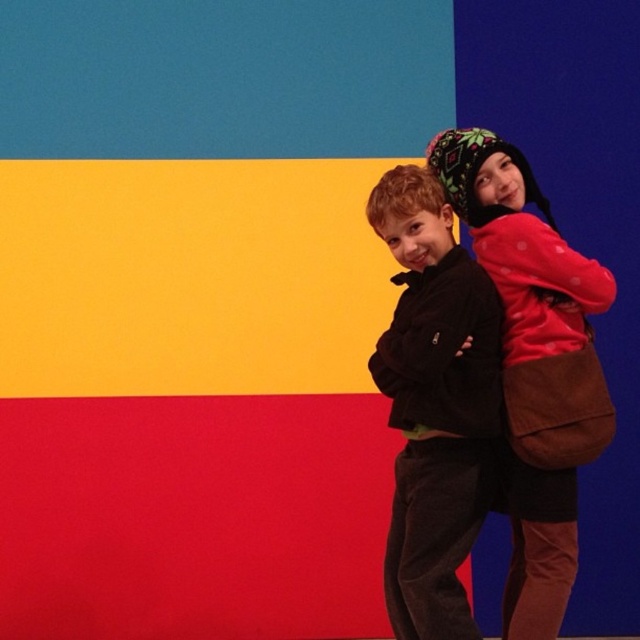
Question: Can you confirm if black fleece jacket at center is positioned above matte red sweater at right?

Choices:
 (A) no
 (B) yes

Answer: (A)

Question: Is black fleece jacket at center below matte red sweater at right?

Choices:
 (A) no
 (B) yes

Answer: (B)

Question: Which of the following is the closest to the observer?

Choices:
 (A) (458, 332)
 (B) (540, 600)

Answer: (A)

Question: Which point is farther to the camera?

Choices:
 (A) matte red sweater at right
 (B) black fleece jacket at center

Answer: (A)

Question: Is black fleece jacket at center to the left of matte red sweater at right from the viewer's perspective?

Choices:
 (A) no
 (B) yes

Answer: (B)